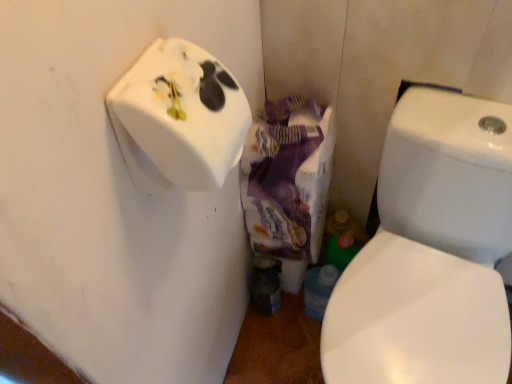
What do you see at coordinates (179, 118) in the screenshot? The height and width of the screenshot is (384, 512). I see `white glossy soap dispenser at upper left` at bounding box center [179, 118].

This screenshot has height=384, width=512. In order to click on white glossy soap dispenser at upper left in this screenshot , I will do `click(179, 118)`.

The width and height of the screenshot is (512, 384). Find the location of `white glossy soap dispenser at upper left`. white glossy soap dispenser at upper left is located at coordinates [x=179, y=118].